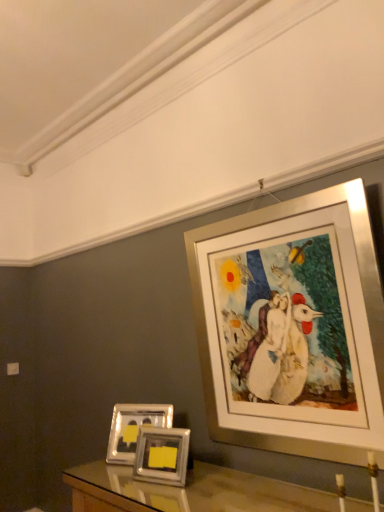
At what (x,y) coordinates should I click in order to perform the action: click on free space above silver metallic picture frame at upper right, marked as the 3th picture frame in a left-to-right arrangement (from a real-world perspective). Please return your answer as a coordinate pair (x, y). The height and width of the screenshot is (512, 384). Looking at the image, I should click on (266, 209).